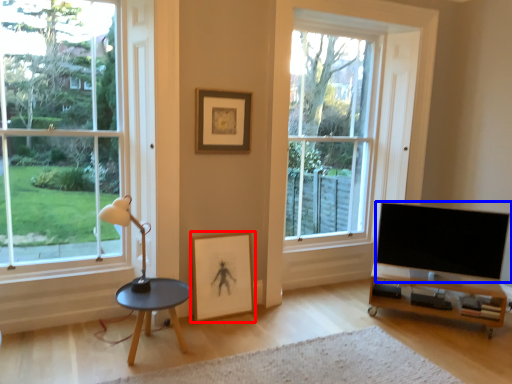
Question: Which object appears farthest to the camera in this image, picture frame (highlighted by a red box) or television (highlighted by a blue box)?

Choices:
 (A) picture frame
 (B) television

Answer: (A)